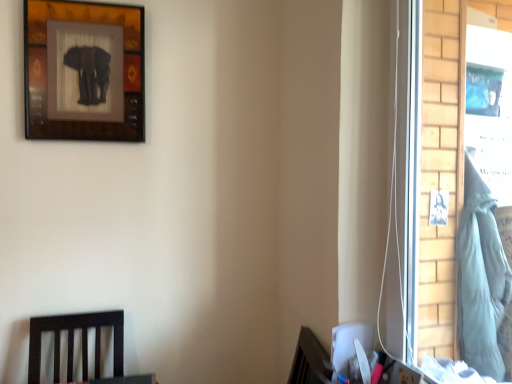
Locate an element on the screen. This screenshot has height=384, width=512. light blue fabric at right is located at coordinates (480, 278).

Image resolution: width=512 pixels, height=384 pixels. What do you see at coordinates (480, 278) in the screenshot?
I see `light blue fabric at right` at bounding box center [480, 278].

Image resolution: width=512 pixels, height=384 pixels. In order to click on wooden elephant art at upper left in this screenshot , I will do `click(84, 71)`.

This screenshot has width=512, height=384. What do you see at coordinates (84, 71) in the screenshot? I see `wooden elephant art at upper left` at bounding box center [84, 71].

Measure the distance between point (63, 28) and camera.

Point (63, 28) is 5.52 feet away from camera.

This screenshot has width=512, height=384. In order to click on light blue fabric at right in this screenshot , I will do pos(480,278).

Between light blue fabric at right and wooden elephant art at upper left, which one appears on the right side from the viewer's perspective?

light blue fabric at right.

Is light blue fabric at right positioned behind wooden elephant art at upper left?

Yes, light blue fabric at right is further from the camera.

Is point (467, 326) less distant than point (124, 120)?

Yes, point (467, 326) is in front of point (124, 120).

From the image's perspective, which one is positioned higher, light blue fabric at right or wooden elephant art at upper left?

wooden elephant art at upper left appears higher in the image.

From a real-world perspective, is light blue fabric at right under wooden elephant art at upper left?

Yes, from a real-world perspective, light blue fabric at right is below wooden elephant art at upper left.

Considering the sizes of light blue fabric at right and wooden elephant art at upper left in the image, is light blue fabric at right wider or thinner than wooden elephant art at upper left?

light blue fabric at right is wider than wooden elephant art at upper left.

Can you confirm if light blue fabric at right is taller than wooden elephant art at upper left?

Indeed, light blue fabric at right has a greater height compared to wooden elephant art at upper left.

Considering the sizes of objects light blue fabric at right and wooden elephant art at upper left in the image provided, who is smaller, light blue fabric at right or wooden elephant art at upper left?

wooden elephant art at upper left is smaller.

Is light blue fabric at right not inside wooden elephant art at upper left?

light blue fabric at right is positioned outside wooden elephant art at upper left.

Is the surface of light blue fabric at right in direct contact with wooden elephant art at upper left?

No, light blue fabric at right is not with wooden elephant art at upper left.

Is wooden elephant art at upper left at the back of light blue fabric at right?

No.

Can you tell me how much light blue fabric at right and wooden elephant art at upper left differ in facing direction?

The angle between the facing direction of light blue fabric at right and the facing direction of wooden elephant art at upper left is 0.000175 degrees.

Find the location of a particular element. Image resolution: width=512 pixels, height=384 pixels. laundry behind the wooden elephant art at upper left is located at coordinates (480, 278).

Consider the image. Considering the relative positions of wooden elephant art at upper left and light blue fabric at right in the image provided, is wooden elephant art at upper left to the right of light blue fabric at right from the viewer's perspective?

No, wooden elephant art at upper left is not to the right of light blue fabric at right.

Who is more distant, wooden elephant art at upper left or light blue fabric at right?

light blue fabric at right is further from the camera.

Is point (67, 42) farther from camera compared to point (497, 306)?

Yes, it is.

From the image's perspective, would you say wooden elephant art at upper left is positioned over light blue fabric at right?

Indeed, from the image's perspective, wooden elephant art at upper left is shown above light blue fabric at right.

From a real-world perspective, who is located lower, wooden elephant art at upper left or light blue fabric at right?

light blue fabric at right.

Which object is wider, wooden elephant art at upper left or light blue fabric at right?

light blue fabric at right is wider.

Who is taller, wooden elephant art at upper left or light blue fabric at right?

light blue fabric at right is taller.

Is wooden elephant art at upper left smaller than light blue fabric at right?

Yes, wooden elephant art at upper left is smaller than light blue fabric at right.

Is wooden elephant art at upper left outside of light blue fabric at right?

Yes.

Can you see wooden elephant art at upper left touching light blue fabric at right?

wooden elephant art at upper left and light blue fabric at right are clearly separated.

In the scene shown: Is wooden elephant art at upper left facing away from light blue fabric at right?

No.

This screenshot has width=512, height=384. I want to click on picture frame on the left of light blue fabric at right, so click(84, 71).

The image size is (512, 384). Identify the location of laundry directly beneath the wooden elephant art at upper left (from a real-world perspective). (480, 278).

The image size is (512, 384). Find the location of `picture frame in front of the light blue fabric at right`. picture frame in front of the light blue fabric at right is located at coordinates (84, 71).